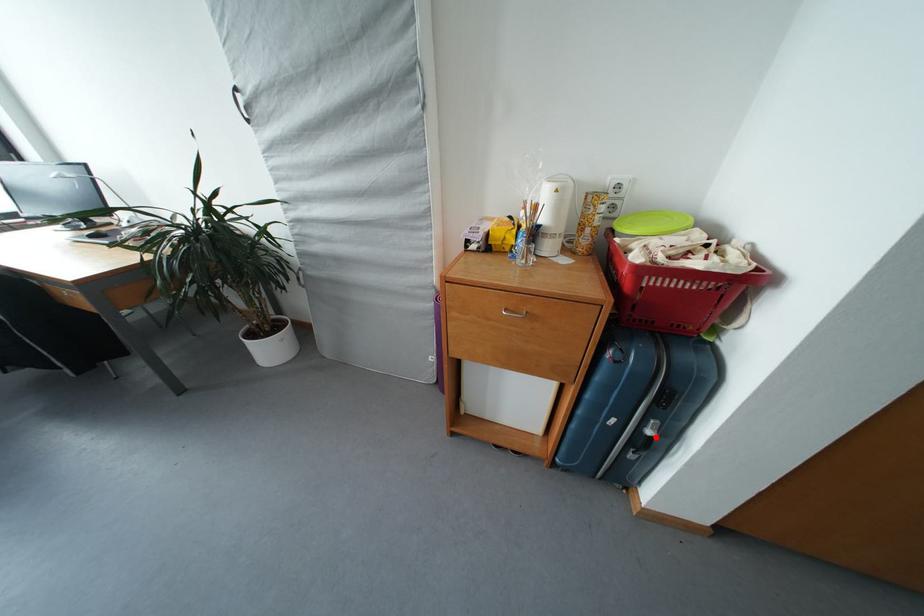
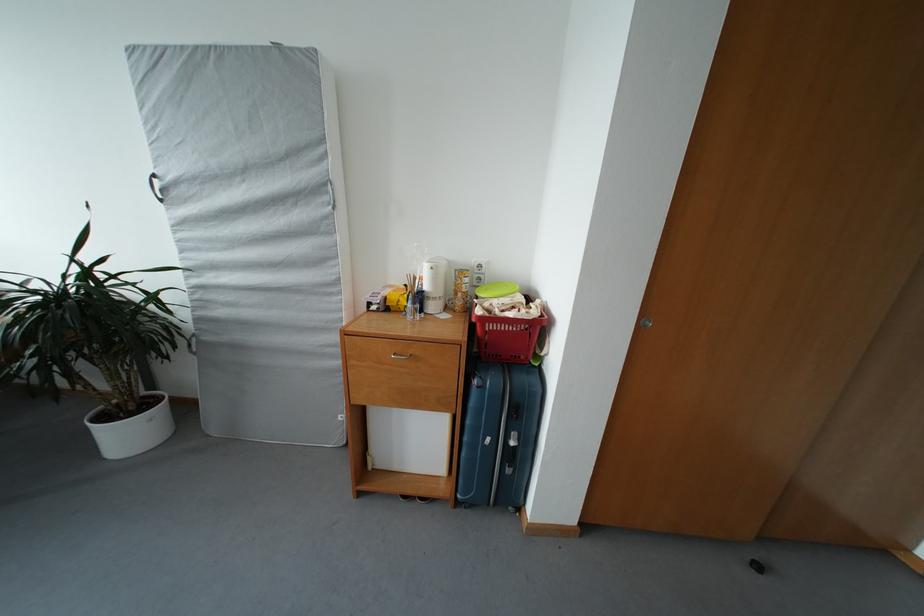
Find the pixel in the second image that matches the highlighted location in the first image.

(518, 448)